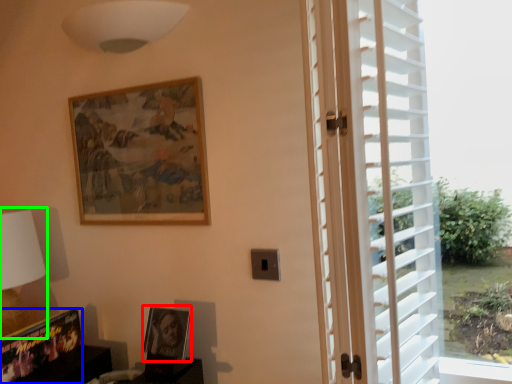
Question: Which object is the farthest from picture frame (highlighted by a red box)? Choose among these: picture frame (highlighted by a blue box) or table lamp (highlighted by a green box).

Choices:
 (A) picture frame
 (B) table lamp

Answer: (B)